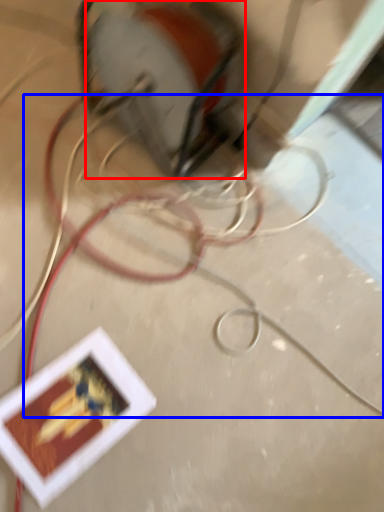
Question: Which of the following is the closest to the observer, power plugs and sockets (highlighted by a red box) or wire (highlighted by a blue box)?

Choices:
 (A) power plugs and sockets
 (B) wire

Answer: (B)